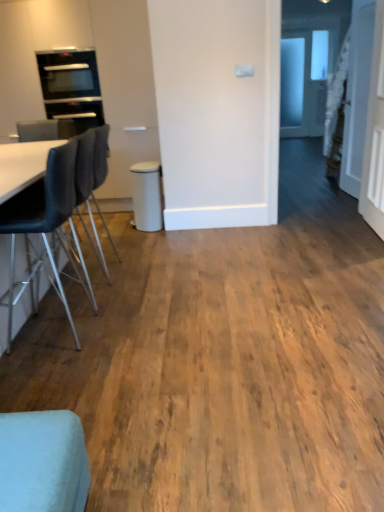
Where is `vacant space to the right of black leather chair at left, the 2th chair from the front`? This screenshot has width=384, height=512. vacant space to the right of black leather chair at left, the 2th chair from the front is located at coordinates (141, 329).